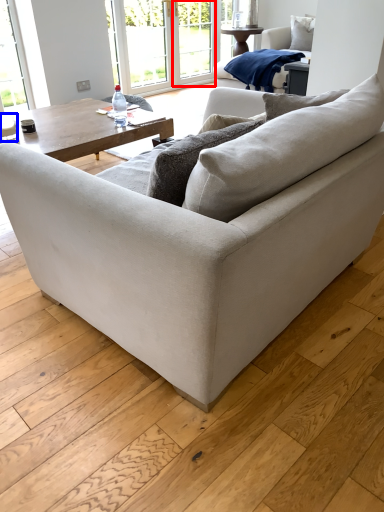
Question: Which object is closer to the camera taking this photo, screen door (highlighted by a red box) or coffee cup (highlighted by a blue box)?

Choices:
 (A) screen door
 (B) coffee cup

Answer: (B)